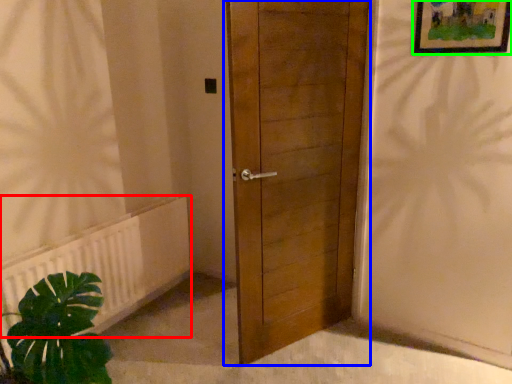
Question: Which object is positioned farthest from radiator (highlighted by a red box)? Select from door (highlighted by a blue box) and picture frame (highlighted by a green box).

Choices:
 (A) door
 (B) picture frame

Answer: (B)